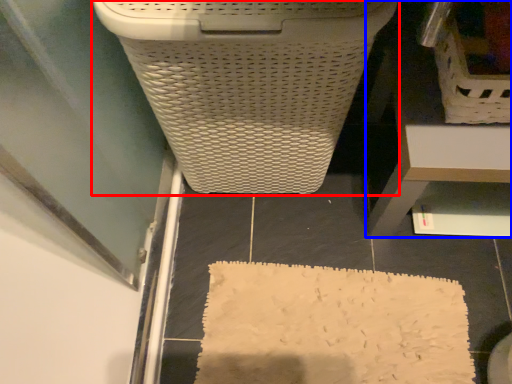
Question: Which object is closer to the camera taking this photo, waste container (highlighted by a red box) or furniture (highlighted by a blue box)?

Choices:
 (A) waste container
 (B) furniture

Answer: (A)